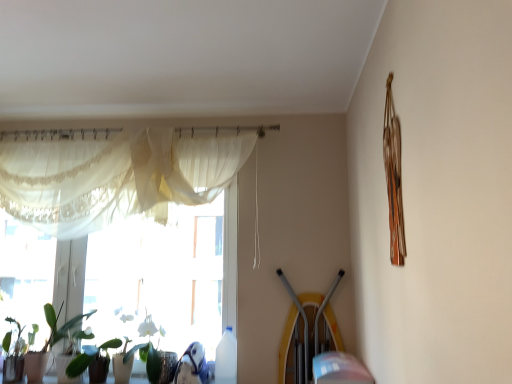
Question: Can you confirm if translucent fabric at left is thinner than green glossy plant at lower left?

Choices:
 (A) yes
 (B) no

Answer: (A)

Question: Does translucent fabric at left come behind green glossy plant at lower left?

Choices:
 (A) yes
 (B) no

Answer: (A)

Question: Does translucent fabric at left have a smaller size compared to green glossy plant at lower left?

Choices:
 (A) no
 (B) yes

Answer: (A)

Question: Does translucent fabric at left lie in front of green glossy plant at lower left?

Choices:
 (A) yes
 (B) no

Answer: (B)

Question: Is translucent fabric at left facing away from green glossy plant at lower left?

Choices:
 (A) yes
 (B) no

Answer: (A)

Question: Considering the positions of green matte plant at lower left and green glossy plant at lower left in the image, is green matte plant at lower left taller or shorter than green glossy plant at lower left?

Choices:
 (A) short
 (B) tall

Answer: (A)

Question: From the image's perspective, is green matte plant at lower left positioned above or below green glossy plant at lower left?

Choices:
 (A) above
 (B) below

Answer: (B)

Question: Considering the positions of green matte plant at lower left and green glossy plant at lower left in the image, is green matte plant at lower left wider or thinner than green glossy plant at lower left?

Choices:
 (A) thin
 (B) wide

Answer: (A)

Question: From a real-world perspective, is green matte plant at lower left above or below green glossy plant at lower left?

Choices:
 (A) above
 (B) below

Answer: (B)

Question: In the image, is green matte plant at lower left positioned in front of or behind translucent fabric at left?

Choices:
 (A) behind
 (B) front

Answer: (B)

Question: Is green matte plant at lower left taller or shorter than translucent fabric at left?

Choices:
 (A) tall
 (B) short

Answer: (B)

Question: Is green matte plant at lower left bigger or smaller than translucent fabric at left?

Choices:
 (A) small
 (B) big

Answer: (A)

Question: From a real-world perspective, is green matte plant at lower left above or below translucent fabric at left?

Choices:
 (A) below
 (B) above

Answer: (A)

Question: Is green glossy plant at lower left taller or shorter than sheer white curtain at upper left?

Choices:
 (A) tall
 (B) short

Answer: (B)

Question: Considering the relative positions of green glossy plant at lower left and sheer white curtain at upper left in the image provided, is green glossy plant at lower left to the left or to the right of sheer white curtain at upper left?

Choices:
 (A) left
 (B) right

Answer: (A)